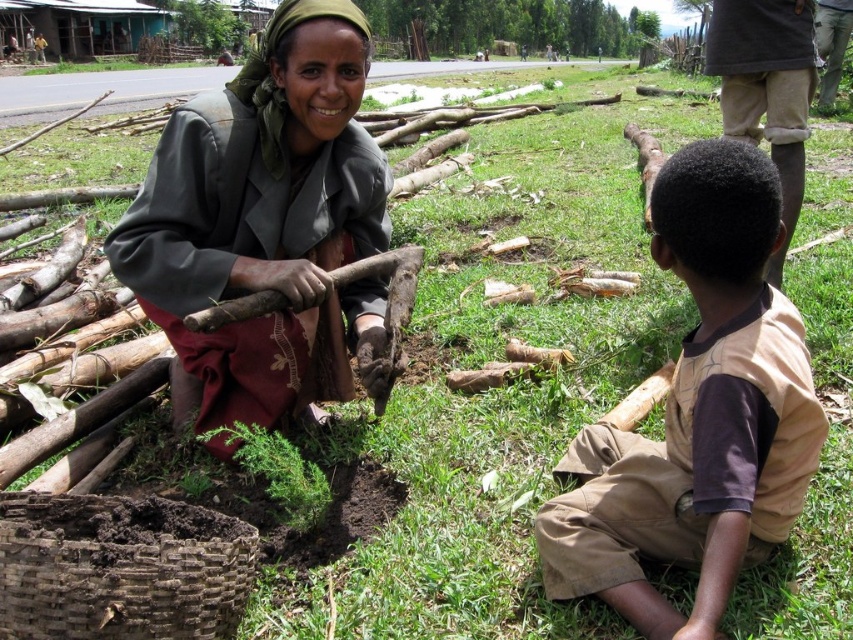
You are standing in the rural scene and want to take a photo of both the woman and the boy. The woman is at point (317,152) and the boy is at point (131,595). Which point is closer to you so you can focus your camera?

Point (131,595) is closer to you than point (317,152), so focus on that point first to ensure the boy is in focus before adjusting for the woman.

What is located at the coordinates point (265, 225) in the image?

The coordinates point 0.313 indicates dark gray fabric at center.

You are a visitor in this rural area and need to locate the brown woven basket at lower left. From the perspective of the brown cotton shirt at center, in which direction should you look to find the basket?

The brown woven basket at lower left is located below the brown cotton shirt at center, so you should look downward from the brown cotton shirt at center to find the basket.